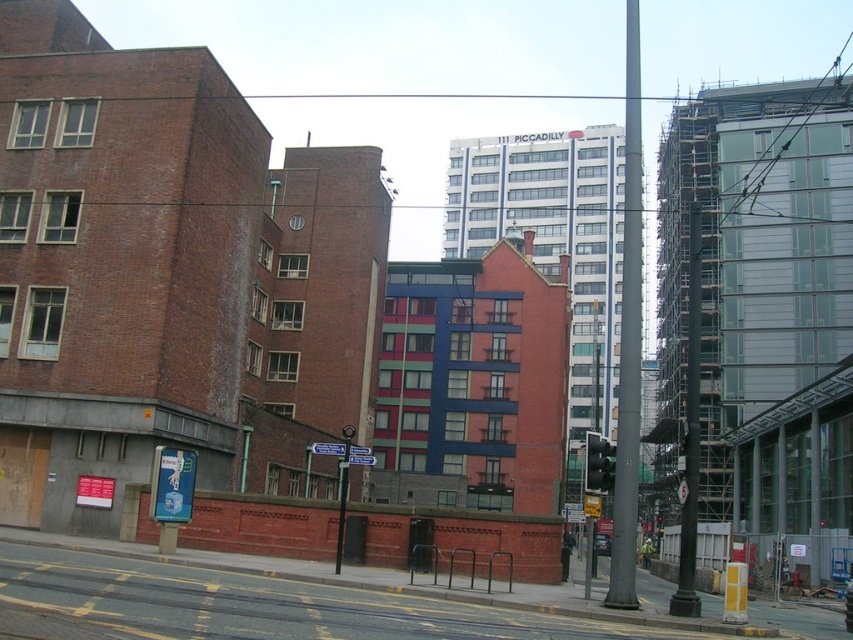
You are a city planner assessing the urban layout. You need to determine the vertical positioning of the metallic gray pole at center and the black glass traffic light at center. Which object is positioned higher in the scene?

The metallic gray pole at center is taller than the black glass traffic light at center, so the metallic gray pole at center is positioned higher in the scene.

You are standing at the point with coordinates point (587,461) and want to walk towards the point with coordinates point (613,579). Which direction should you move to get closer to your destination?

You should move forward because point (613,579) is closer to the camera than point (587,461), meaning it is in front of you.

Based on the photo, you are a city planner designing a new pedestrian walkway between the metallic gray pole at center and the black glass traffic light at center. Given that the walkway must be 500 feet long to accommodate all pedestrians, will the proposed walkway fit between them?

The metallic gray pole at center and the black glass traffic light at center are 482.76 feet apart from each other. Since the proposed walkway is 500 feet long, it is slightly longer than the distance between them. Therefore, the walkway will not fit as it exceeds the available space by approximately 17.24 feet.